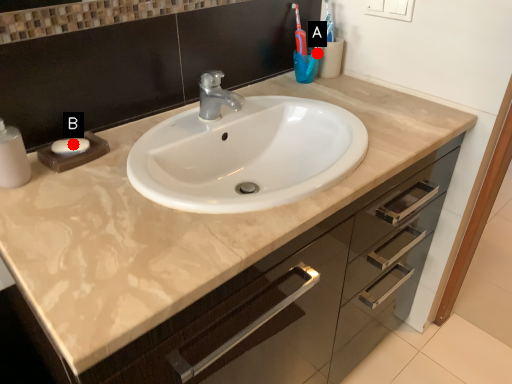
Question: Two points are circled on the image, labeled by A and B beside each circle. Among these points, which one is farthest from the camera?

Choices:
 (A) A is further
 (B) B is further

Answer: (A)